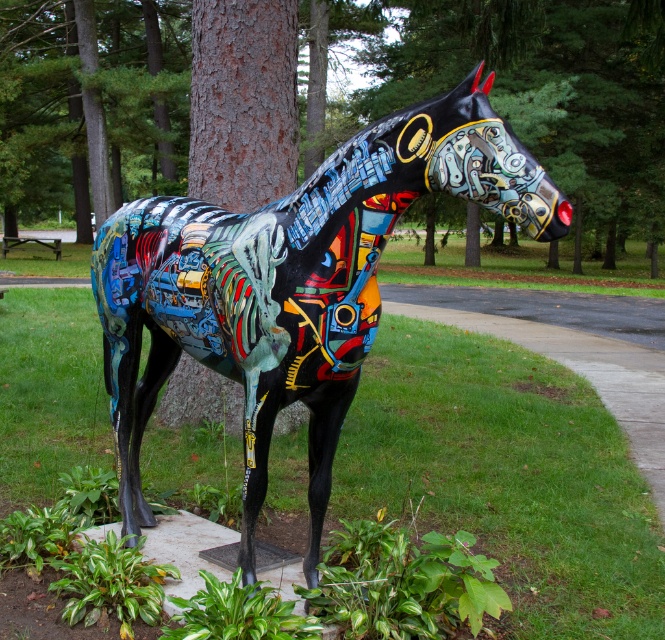
You are an artist planning to sketch the scene. You notice the brown textured tree trunk at center and the metallic painted horse at center. Which object is located to the left of the other?

The brown textured tree trunk at center is positioned on the left side of metallic painted horse at center.

You are standing in the park and want to take a photo of both the brown textured tree trunk at center and the brown rough bark tree at center. Which tree should you focus on first to ensure both are in the frame?

You should focus on the brown textured tree trunk at center first because it is closer to you than the brown rough bark tree at center, so adjusting the camera to include both would require ensuring the closer one is framed first.

You are an artist planning to paint a scene that includes both the brown textured tree trunk at center and the brown rough bark tree at center. Based on their sizes, which tree should you paint larger in your artwork?

The brown textured tree trunk at center should be painted larger because it is bigger than the brown rough bark tree at center according to the description.